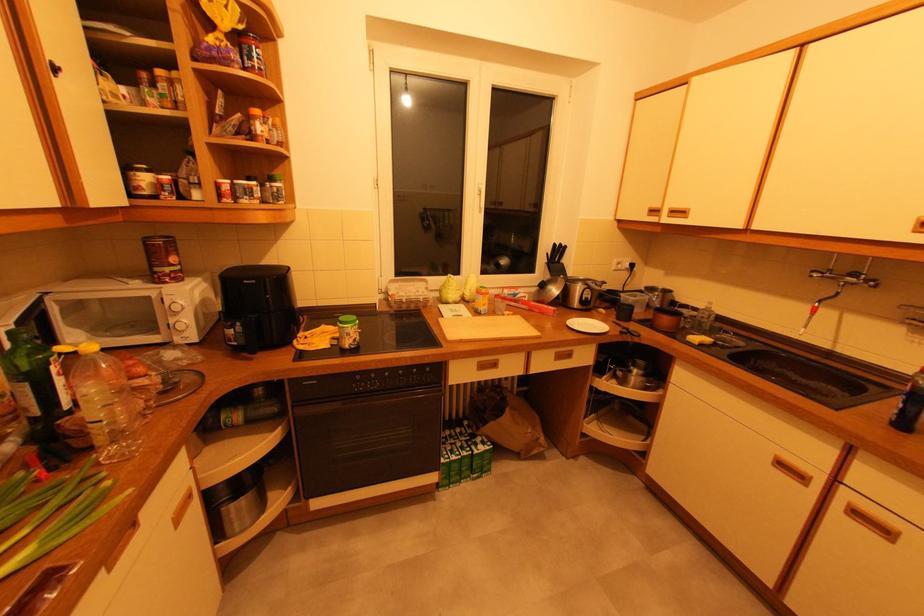
Describe the element at coordinates (481, 197) in the screenshot. I see `the white window handle` at that location.